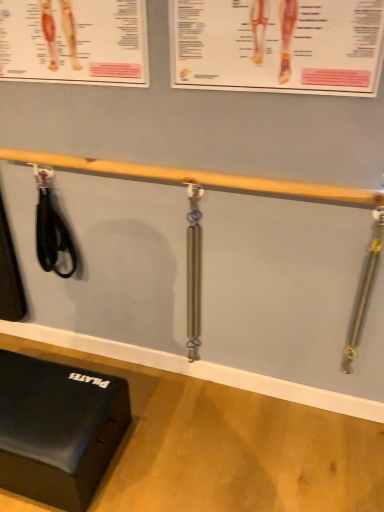
Question: Is black rubber exercise mat at lower left surrounding wooden beam at upper center?

Choices:
 (A) yes
 (B) no

Answer: (B)

Question: Is black rubber exercise mat at lower left wider than wooden beam at upper center?

Choices:
 (A) no
 (B) yes

Answer: (B)

Question: From the image's perspective, is black rubber exercise mat at lower left on wooden beam at upper center?

Choices:
 (A) yes
 (B) no

Answer: (B)

Question: Is black rubber exercise mat at lower left outside wooden beam at upper center?

Choices:
 (A) no
 (B) yes

Answer: (B)

Question: Does black rubber exercise mat at lower left have a smaller size compared to wooden beam at upper center?

Choices:
 (A) yes
 (B) no

Answer: (B)

Question: From a real-world perspective, is black rubber exercise mat at lower left positioned over wooden beam at upper center based on gravity?

Choices:
 (A) yes
 (B) no

Answer: (B)

Question: Does silver metallic resistance band at right, the third tool positioned from the left, have a smaller size compared to black rubber strap at left, marked as the 1th tool in a left-to-right arrangement?

Choices:
 (A) no
 (B) yes

Answer: (B)

Question: Is silver metallic resistance band at right, the first tool positioned from the right, oriented towards black rubber strap at left, marked as the 1th tool in a left-to-right arrangement?

Choices:
 (A) yes
 (B) no

Answer: (B)

Question: From the image's perspective, is silver metallic resistance band at right, the first tool positioned from the right, beneath black rubber strap at left, which is the 3th tool from right to left?

Choices:
 (A) no
 (B) yes

Answer: (B)

Question: Is silver metallic resistance band at right, the third tool positioned from the left, oriented away from black rubber strap at left, marked as the 1th tool in a left-to-right arrangement?

Choices:
 (A) no
 (B) yes

Answer: (A)

Question: Are silver metallic resistance band at right, the third tool positioned from the left, and black rubber strap at left, which is the 3th tool from right to left, beside each other?

Choices:
 (A) yes
 (B) no

Answer: (B)

Question: Does silver metallic resistance band at right, the third tool positioned from the left, appear on the right side of black rubber strap at left, which is the 3th tool from right to left?

Choices:
 (A) yes
 (B) no

Answer: (A)

Question: Can you confirm if black rubber strap at left, marked as the 1th tool in a left-to-right arrangement, is positioned to the right of wooden beam at upper center?

Choices:
 (A) yes
 (B) no

Answer: (B)